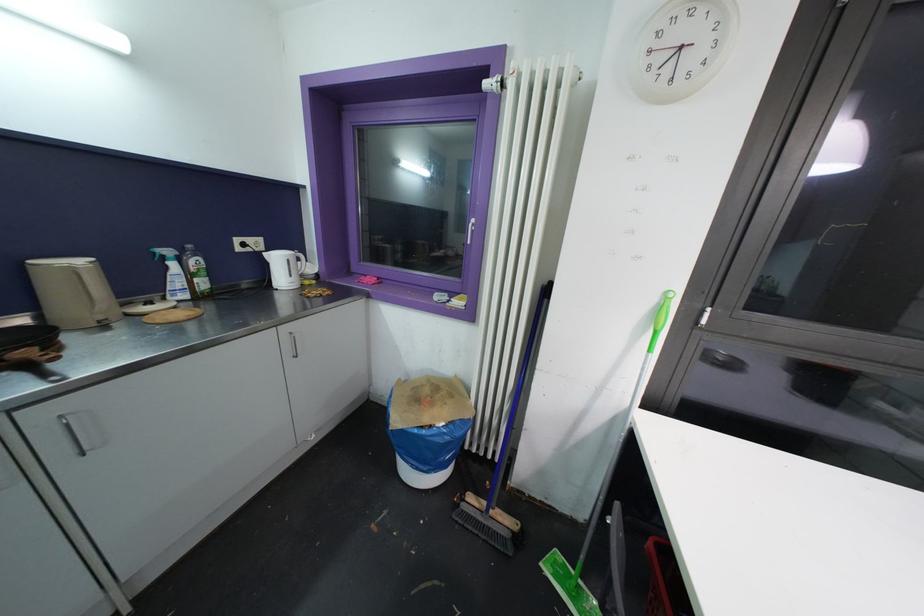
Find where to pull the silver cabinet handle. Please return your answer as a coordinate pair (x, y).

(293, 344)